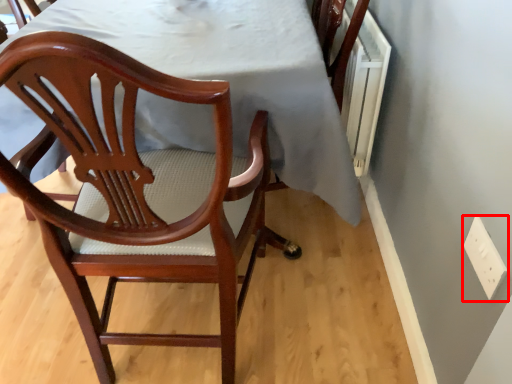
Question: From the image's perspective, where is electric outlet (annotated by the red box) located in relation to chair in the image?

Choices:
 (A) above
 (B) below

Answer: (B)